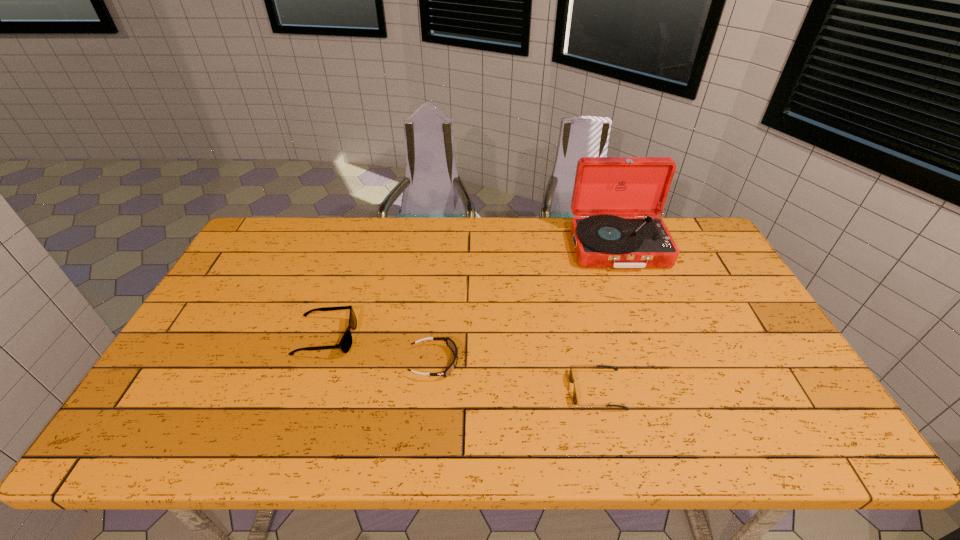
This screenshot has height=540, width=960. I want to click on the farthest object, so click(x=605, y=187).

The height and width of the screenshot is (540, 960). I want to click on phonograph_record, so click(605, 187).

The width and height of the screenshot is (960, 540). In order to click on the second tallest object in this screenshot , I will do `click(345, 344)`.

This screenshot has width=960, height=540. What are the coordinates of `the leftmost object` in the screenshot? It's located at (345, 344).

Where is `goggles`? The height and width of the screenshot is (540, 960). goggles is located at coordinates (450, 343).

Image resolution: width=960 pixels, height=540 pixels. I want to click on the nearer sunglasses, so click(571, 378).

Find the location of a particular element. The height and width of the screenshot is (540, 960). the right sunglasses is located at coordinates (571, 378).

The width and height of the screenshot is (960, 540). Find the location of `vacant space situated on the front-facing side of the farthest object`. vacant space situated on the front-facing side of the farthest object is located at coordinates (644, 316).

You are a GUI agent. You are given a task and a screenshot of the screen. Output one action in this format:
    pyautogui.click(x=<x>, y=<y>)
    Task: Click on the free point located on the front-facing side of the farther sunglasses
    The height and width of the screenshot is (540, 960).
    Given the screenshot: What is the action you would take?
    pyautogui.click(x=484, y=338)

Locate an element on the screen. The width and height of the screenshot is (960, 540). vacant space located on the front and sides of the goggles is located at coordinates (540, 362).